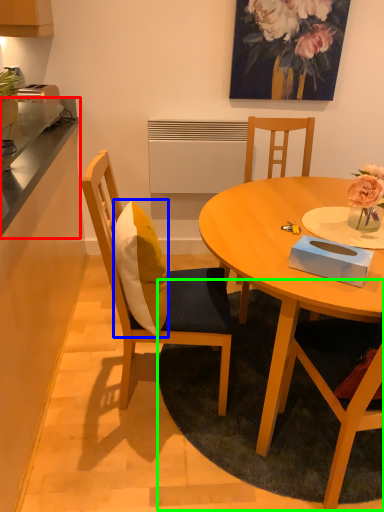
Question: Considering the real-world distances, which object is farthest from counter top (highlighted by a red box)? pillow (highlighted by a blue box) or mat (highlighted by a green box)?

Choices:
 (A) pillow
 (B) mat

Answer: (B)